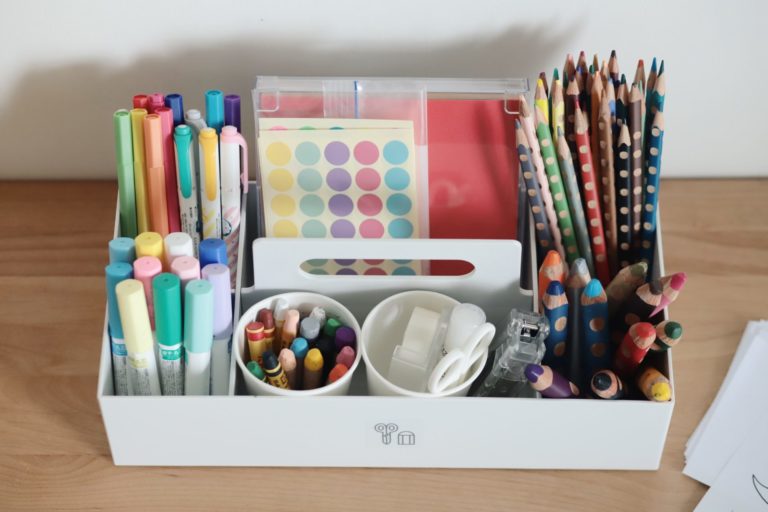
The height and width of the screenshot is (512, 768). Find the location of `yellow sticker labels`. yellow sticker labels is located at coordinates (276, 151), (277, 179), (283, 207), (283, 226).